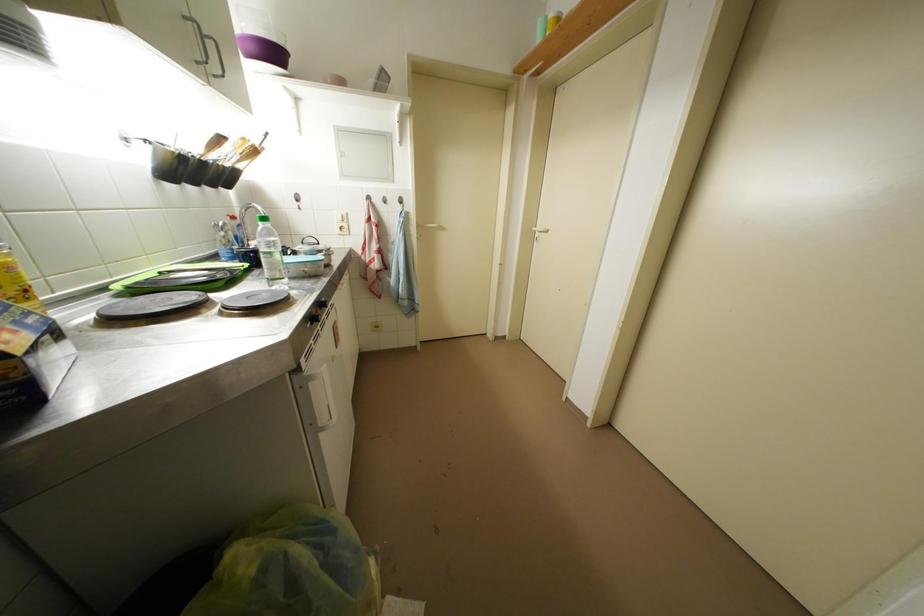
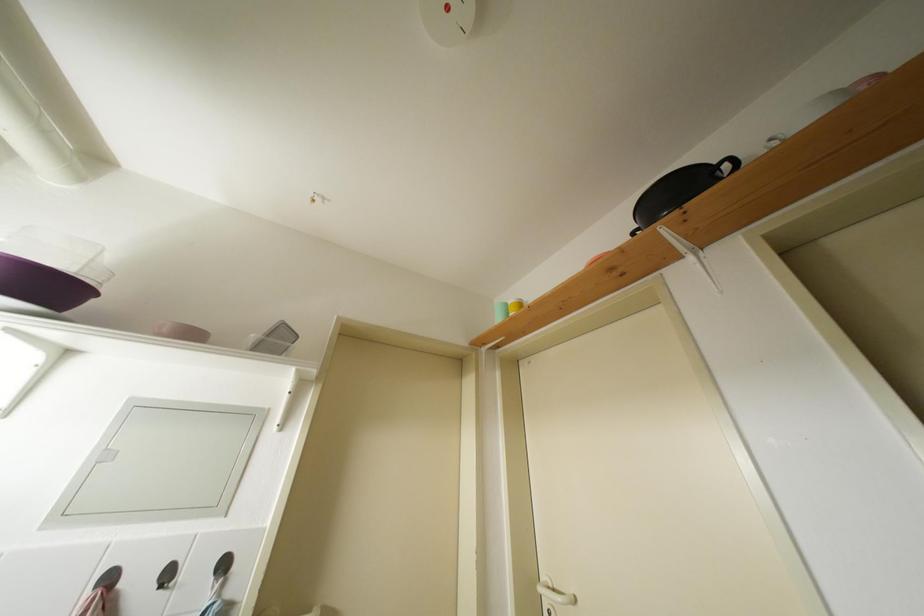
Based on the continuous images, in which direction is the camera rotating?

The camera rotated toward right-up.